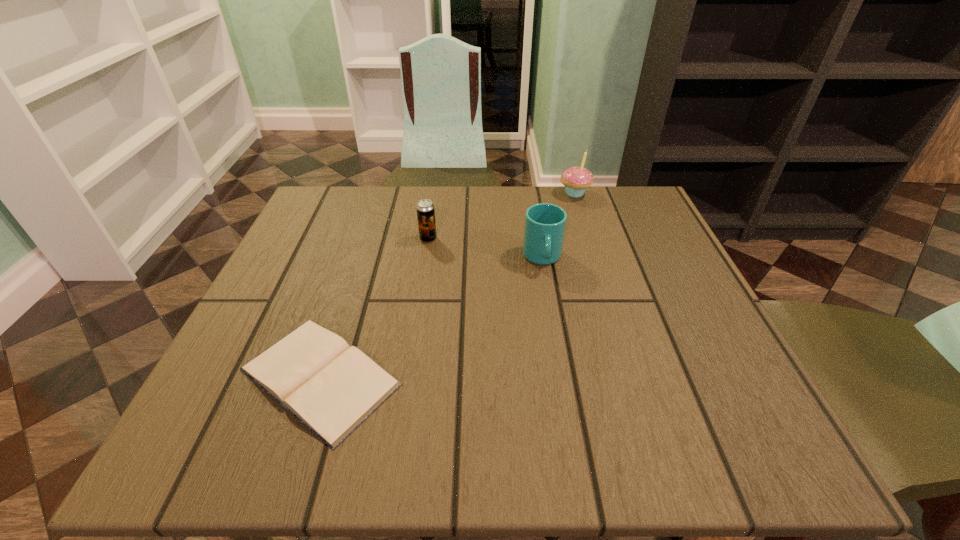
You are a GUI agent. You are given a task and a screenshot of the screen. Output one action in this format:
    pyautogui.click(x=<x>, y=<y>)
    Task: Click on the farthest object
    The width and height of the screenshot is (960, 540).
    Given the screenshot: What is the action you would take?
    pyautogui.click(x=576, y=180)

This screenshot has height=540, width=960. In order to click on the rightmost object in this screenshot , I will do `click(576, 180)`.

Find the location of a particular element. The image size is (960, 540). the third object from left to right is located at coordinates (545, 223).

Where is `beer can`? Image resolution: width=960 pixels, height=540 pixels. beer can is located at coordinates (425, 209).

Locate an element on the screen. The image size is (960, 540). Bible is located at coordinates (330, 387).

Locate an element on the screen. Image resolution: width=960 pixels, height=540 pixels. the shortest object is located at coordinates (330, 387).

At what (x,y) coordinates should I click in order to perform the action: click on vacant space located on the front of the cupcake. Please return your answer as a coordinate pair (x, y). Looking at the image, I should click on (590, 243).

Image resolution: width=960 pixels, height=540 pixels. I want to click on vacant region located 0.260m on the handle side of the second object from right to left, so click(564, 383).

This screenshot has width=960, height=540. I want to click on vacant region located on the left of the beer can, so click(334, 239).

This screenshot has width=960, height=540. Identify the location of free region located 0.110m on the back of the nearest object. (352, 279).